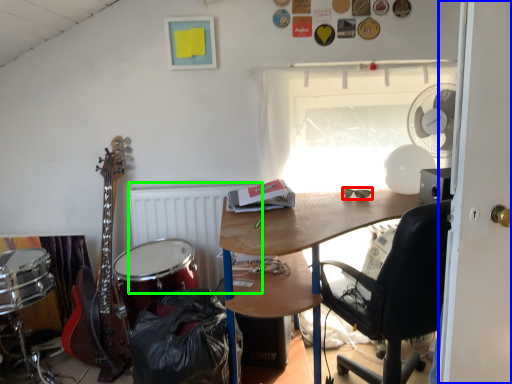
Question: Estimate the real-world distances between objects in this image. Which object is farther from glasses (highlighted by a red box), door (highlighted by a blue box) or radiator (highlighted by a green box)?

Choices:
 (A) door
 (B) radiator

Answer: (B)